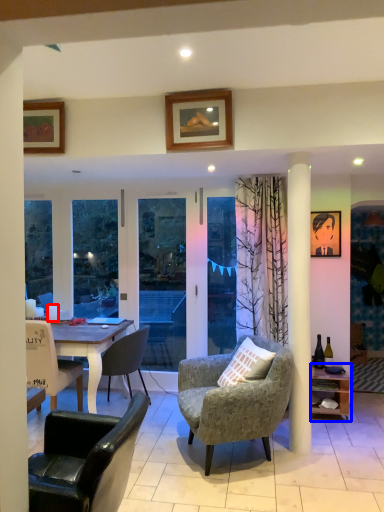
Question: Which point is closer to the camera, coffee cup (highlighted by a red box) or shelf (highlighted by a blue box)?

Choices:
 (A) coffee cup
 (B) shelf

Answer: (B)